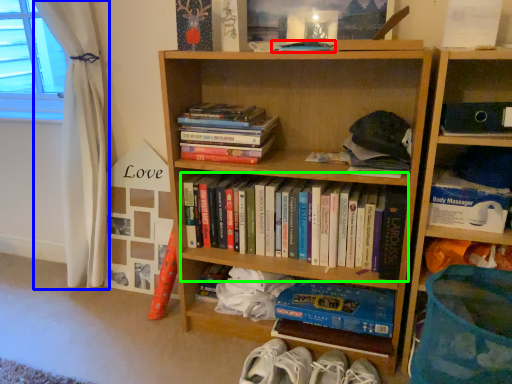
Question: Estimate the real-world distances between objects in this image. Which object is closer to book (highlighted by a red box), curtain (highlighted by a blue box) or book (highlighted by a green box)?

Choices:
 (A) curtain
 (B) book

Answer: (B)